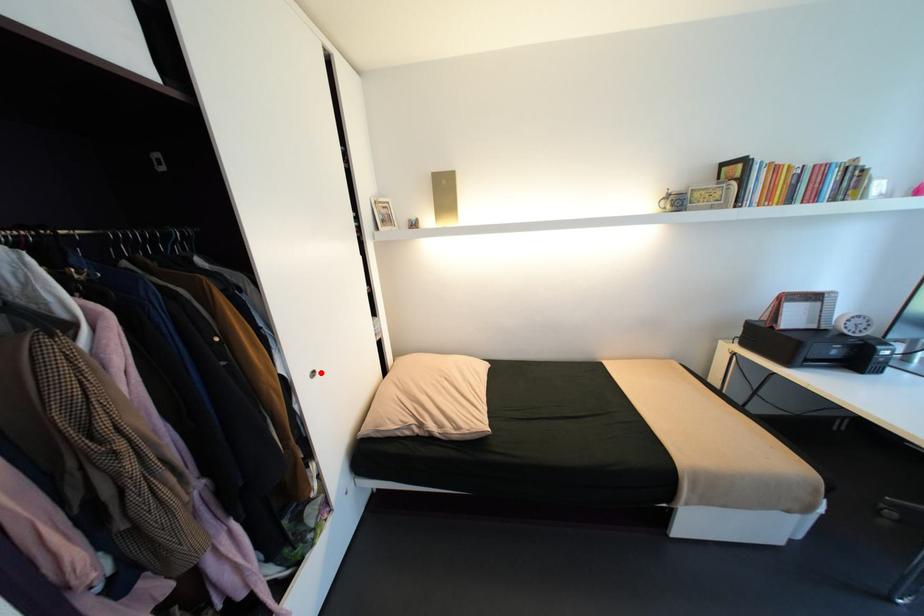
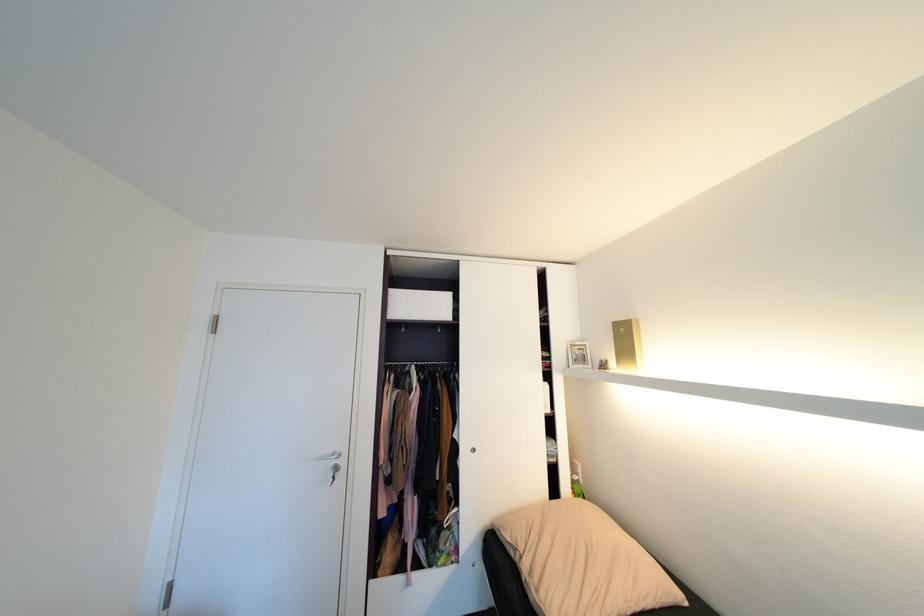
Question: I am providing you with two images of the same scene from different viewpoints. In image1, a red point is highlighted. Considering the same 3D point in image2, which of the following is correct?

Choices:
 (A) It is closer
 (B) It is farther

Answer: (B)